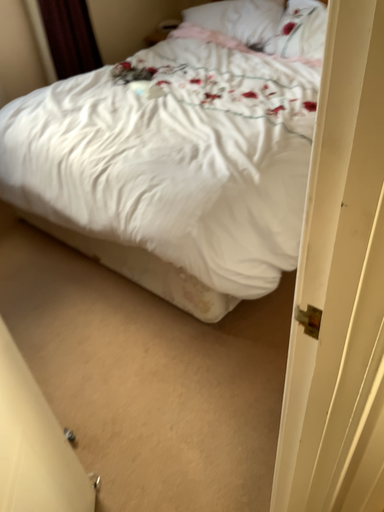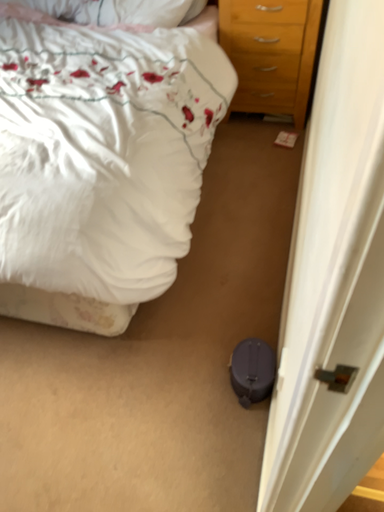
Question: How did the camera likely rotate when shooting the video?

Choices:
 (A) rotated left
 (B) rotated right

Answer: (B)